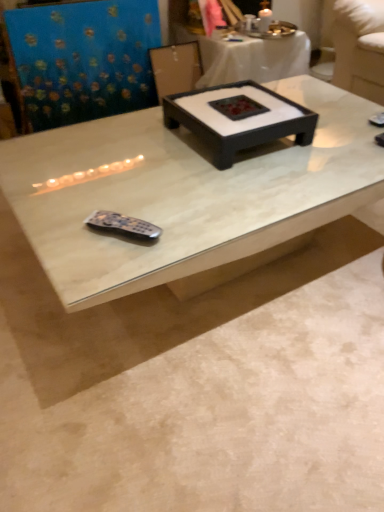
Identify the location of vacant space situated on the left part of black matte tray at center, which ranks as the 2th coffee table in left-to-right order. (127, 148).